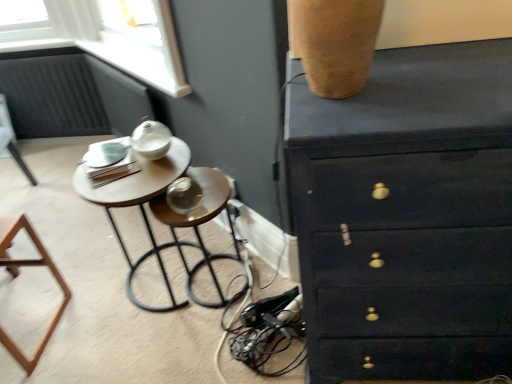
Question: Considering the relative positions of wooden bar stool at center and matte white lamp at upper left, positioned as the second furniture in right-to-left order, in the image provided, is wooden bar stool at center to the left or to the right of matte white lamp at upper left, positioned as the second furniture in right-to-left order,?

Choices:
 (A) right
 (B) left

Answer: (A)

Question: From a real-world perspective, is wooden bar stool at center above or below matte white lamp at upper left, positioned as the second furniture in right-to-left order?

Choices:
 (A) above
 (B) below

Answer: (A)

Question: Considering the real-world distances, which object is closest to the matte white lamp at upper left, positioned as the second furniture in right-to-left order?

Choices:
 (A) dark wood chest of drawers at upper right
 (B) matte wood side table at left
 (C) wooden bar stool at center
 (D) brown wooden frame at lower left, which ranks as the 1th furniture in bottom-to-top order

Answer: (D)

Question: Which of these objects is positioned farthest from the matte white lamp at upper left, acting as the 2th furniture starting from the front?

Choices:
 (A) wooden bar stool at center
 (B) matte wood side table at left
 (C) dark wood chest of drawers at upper right
 (D) brown wooden frame at lower left, the second furniture from the top

Answer: (C)